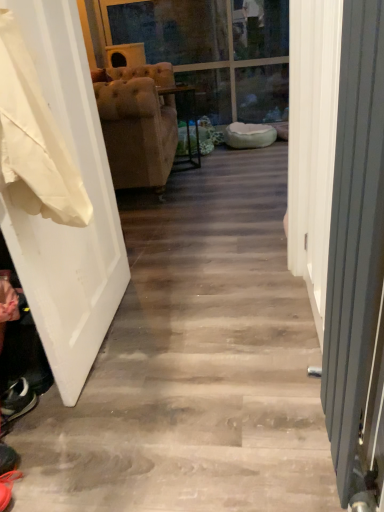
Question: Do you think shiny black shoe at lower left is within metallic gray radiator at right, or outside of it?

Choices:
 (A) inside
 (B) outside

Answer: (B)

Question: In terms of height, does shiny black shoe at lower left look taller or shorter compared to metallic gray radiator at right?

Choices:
 (A) short
 (B) tall

Answer: (A)

Question: Which of these objects is positioned farthest from the metallic gray radiator at right?

Choices:
 (A) white fabric at left
 (B) suede-like beige armchair at center
 (C) transparent glass door at upper center
 (D) shiny black shoe at lower left
 (E) white matte door at left

Answer: (C)

Question: Considering the real-world distances, which object is farthest from the shiny black shoe at lower left?

Choices:
 (A) suede-like beige armchair at center
 (B) white fabric at left
 (C) white matte door at left
 (D) transparent glass door at upper center
 (E) metallic gray radiator at right

Answer: (D)